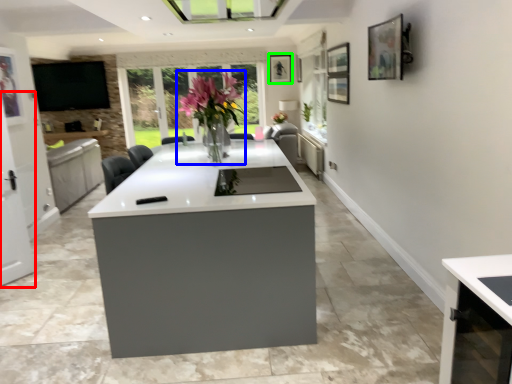
Question: Considering the real-world distances, which object is farthest from screen door (highlighted by a red box)? floral arrangement (highlighted by a blue box) or picture frame (highlighted by a green box)?

Choices:
 (A) floral arrangement
 (B) picture frame

Answer: (B)